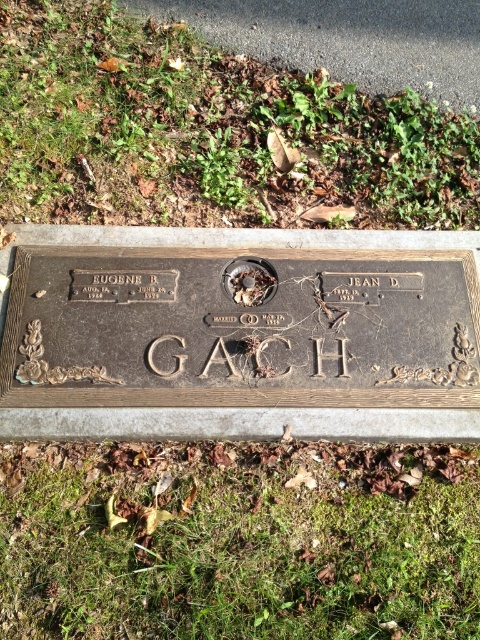
Can you confirm if green grass at lower center is bigger than green grass at upper center?

No.

Who is shorter, green grass at lower center or green grass at upper center?

green grass at lower center is shorter.

Describe the element at coordinates (240, 541) in the screenshot. I see `green grass at lower center` at that location.

This screenshot has height=640, width=480. Identify the location of green grass at lower center. (240, 541).

Is the position of green grass at upper center more distant than that of bronze plaque at center?

Yes.

How distant is green grass at upper center from bronze plaque at center?

A distance of 23.27 inches exists between green grass at upper center and bronze plaque at center.

The height and width of the screenshot is (640, 480). What do you see at coordinates (207, 132) in the screenshot?
I see `green grass at upper center` at bounding box center [207, 132].

Locate an element on the screen. The height and width of the screenshot is (640, 480). green grass at upper center is located at coordinates (207, 132).

Describe the element at coordinates (240, 541) in the screenshot. I see `green grass at lower center` at that location.

At what (x,y) coordinates should I click in order to perform the action: click on green grass at lower center. Please return your answer as a coordinate pair (x, y). Looking at the image, I should click on pos(240,541).